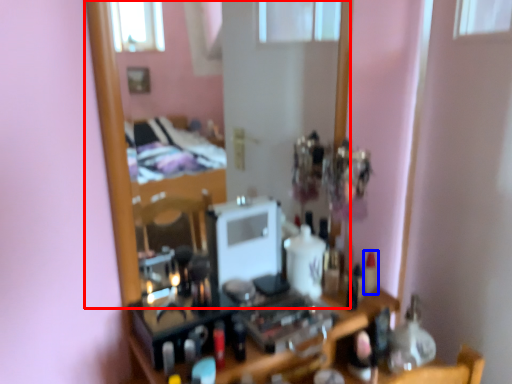
Question: Which object appears farthest to the camera in this image, mirror (highlighted by a red box) or toiletry (highlighted by a blue box)?

Choices:
 (A) mirror
 (B) toiletry

Answer: (B)